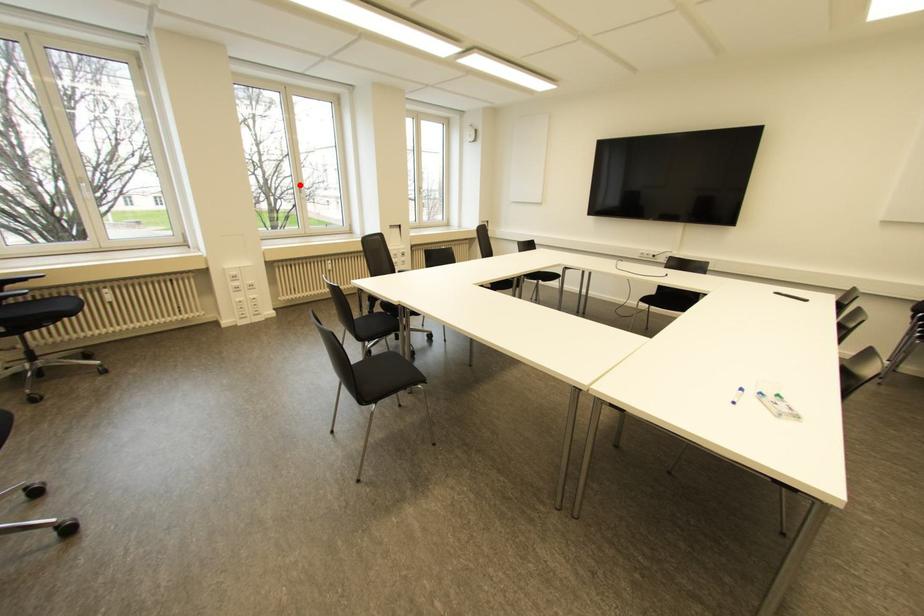
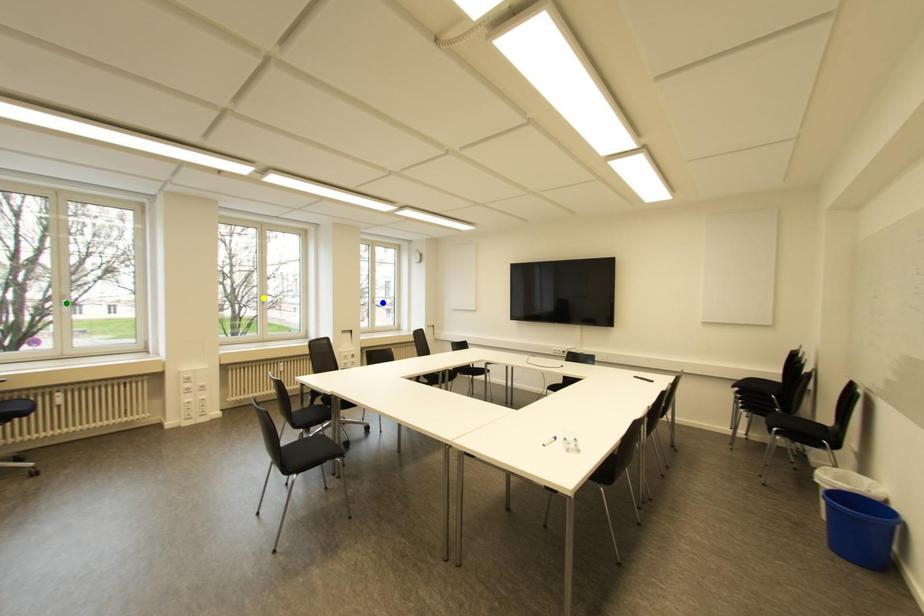
Question: I am providing you with two images of the same scene from different viewpoints. A red point is marked on the first image. You are given multiple points on the second image. In image 2, which mark is for the same physical point as the one in image 1?

Choices:
 (A) yellow point
 (B) green point
 (C) blue point

Answer: (A)